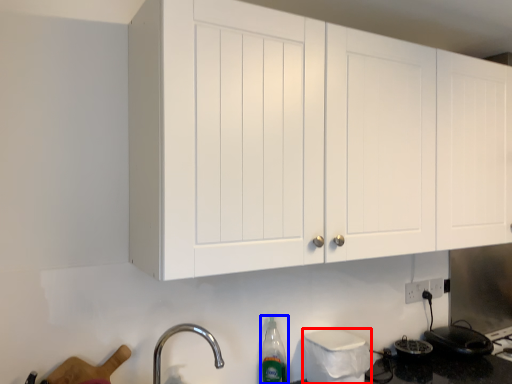
Question: Which object is closer to the camera taking this photo, appliance (highlighted by a red box) or bottle (highlighted by a blue box)?

Choices:
 (A) appliance
 (B) bottle

Answer: (A)